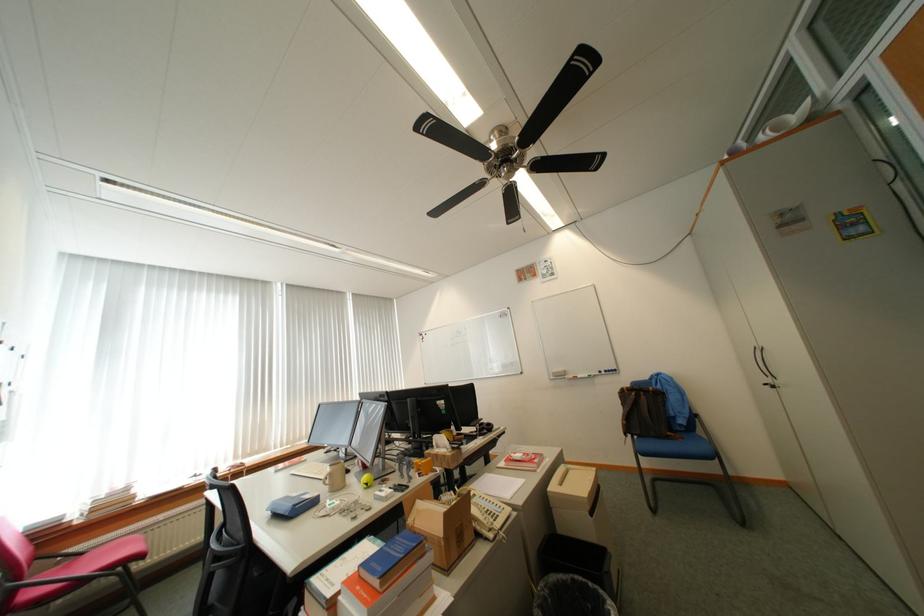
The height and width of the screenshot is (616, 924). What do you see at coordinates (99, 560) in the screenshot?
I see `a red chair sitting surface` at bounding box center [99, 560].